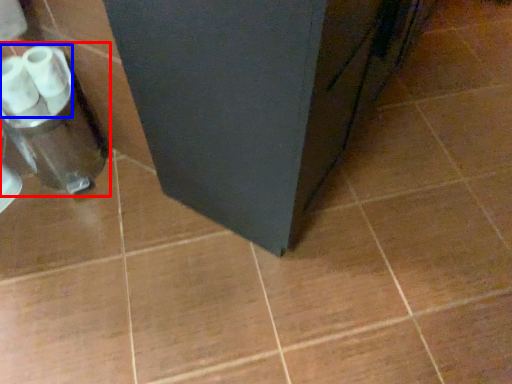
Question: Among these objects, which one is nearest to the camera, blender (highlighted by a red box) or toilet paper (highlighted by a blue box)?

Choices:
 (A) blender
 (B) toilet paper

Answer: (B)